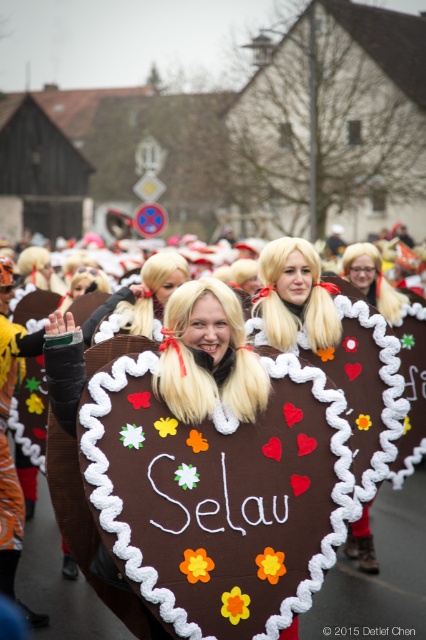
In the scene shown: You are standing at the origin of a coordinate system placed at the bottom left corner of the image. The brown cardboard heart at center is located at point (380, 570). If you want to move directly towards the brown cardboard heart at center, in which direction should you move?

Since the coordinate system has its origin at the bottom left corner, the x and y axes increase to the right and upwards respectively. The point (380, 570) has an x value greater than your current position at the origin and a y value also greater than the origin. Therefore, you should move northeast to reach the brown cardboard heart at center.

You are a photographer at the parade and want to capture a photo where the brown cardboard heart at center is clearly visible above the blonde wig at center. Based on the scene description, is this possible?

Yes, because the brown cardboard heart at center is located above the blonde wig at center, so positioning the camera to focus on the heart will naturally show it above the wig.

You are a photographer at the parade and want to capture a photo of the brown cardboard heart at center and the blonde wig at center. From your current position, which object should you frame first in your camera viewfinder to ensure both are in the shot?

The brown cardboard heart at center is to the left of blonde wig at center. Therefore, you should frame the brown cardboard heart at center first since it is positioned to the left of the blonde wig at center, ensuring both are included in the shot.